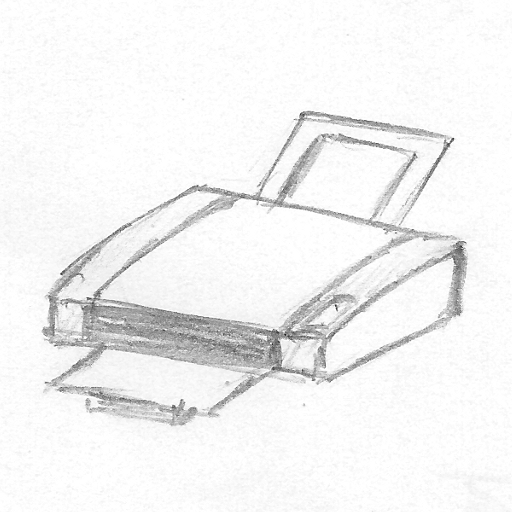
Locate an element on the screen. The height and width of the screenshot is (512, 512). laser printer control screen is located at coordinates (320, 321).